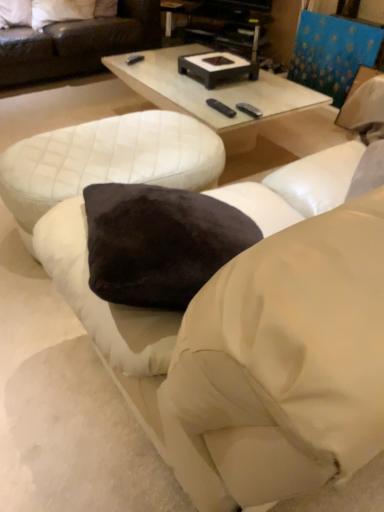
Question: Could you tell me if velvet dark brown pillow at upper left, placed as the 1th pillow when sorted from left to right, is facing white quilted ottoman at lower left?

Choices:
 (A) yes
 (B) no

Answer: (A)

Question: Is velvet dark brown pillow at upper left, placed as the 1th pillow when sorted from left to right, directly adjacent to white quilted ottoman at lower left?

Choices:
 (A) yes
 (B) no

Answer: (B)

Question: Is velvet dark brown pillow at upper left, placed as the 1th pillow when sorted from left to right, positioned in front of white quilted ottoman at lower left?

Choices:
 (A) yes
 (B) no

Answer: (B)

Question: Is velvet dark brown pillow at upper left, placed as the 1th pillow when sorted from left to right, to the left of white quilted ottoman at lower left from the viewer's perspective?

Choices:
 (A) no
 (B) yes

Answer: (B)

Question: Can you confirm if velvet dark brown pillow at upper left, the 2th pillow in the right-to-left sequence, is thinner than white quilted ottoman at lower left?

Choices:
 (A) yes
 (B) no

Answer: (A)

Question: Is velvet dark brown pillow at upper left, placed as the 1th pillow when sorted from left to right, bigger than white quilted ottoman at lower left?

Choices:
 (A) yes
 (B) no

Answer: (B)

Question: Considering the relative sizes of black plastic entertainment center at upper center and velvet dark brown pillow at upper left, the 2th pillow in the right-to-left sequence, in the image provided, is black plastic entertainment center at upper center wider than velvet dark brown pillow at upper left, the 2th pillow in the right-to-left sequence,?

Choices:
 (A) yes
 (B) no

Answer: (A)

Question: From the image's perspective, is black plastic entertainment center at upper center over velvet dark brown pillow at upper left, the 2th pillow in the right-to-left sequence?

Choices:
 (A) no
 (B) yes

Answer: (A)

Question: From the image's perspective, is black plastic entertainment center at upper center under velvet dark brown pillow at upper left, placed as the 1th pillow when sorted from left to right?

Choices:
 (A) no
 (B) yes

Answer: (B)

Question: Can you confirm if black plastic entertainment center at upper center is taller than velvet dark brown pillow at upper left, the 2th pillow in the right-to-left sequence?

Choices:
 (A) yes
 (B) no

Answer: (A)

Question: Considering the relative positions of black plastic entertainment center at upper center and velvet dark brown pillow at upper left, placed as the 1th pillow when sorted from left to right, in the image provided, is black plastic entertainment center at upper center behind velvet dark brown pillow at upper left, placed as the 1th pillow when sorted from left to right,?

Choices:
 (A) no
 (B) yes

Answer: (B)

Question: Considering the relative positions of black plastic entertainment center at upper center and velvet dark brown pillow at upper left, the 2th pillow in the right-to-left sequence, in the image provided, is black plastic entertainment center at upper center to the right of velvet dark brown pillow at upper left, the 2th pillow in the right-to-left sequence, from the viewer's perspective?

Choices:
 (A) yes
 (B) no

Answer: (A)

Question: Is black plastic entertainment center at upper center surrounding white glossy coffee table at center?

Choices:
 (A) no
 (B) yes

Answer: (A)